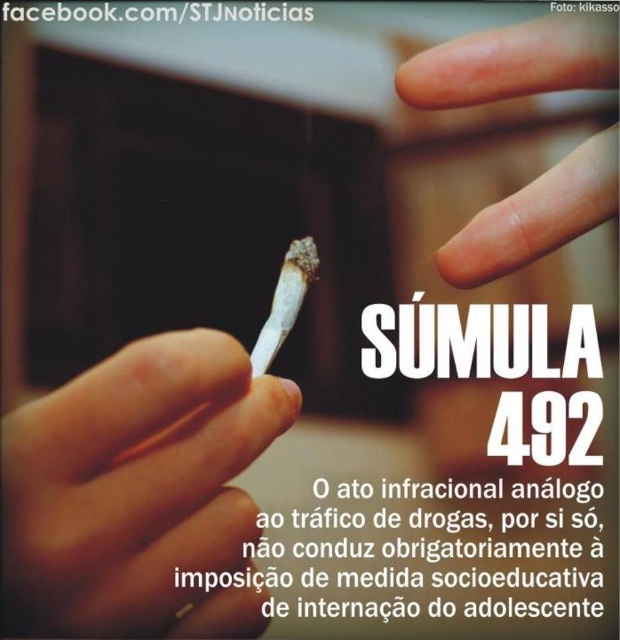
You are a legal analyst reviewing an image for a case involving drug trafficking. The image shows a white matte cigarette at center and dry skin at upper center. According to the legal text displayed in the image, which object is more likely to be associated with the act of drug trafficking?

The white matte cigarette at center is more likely to be associated with the act of drug trafficking because it is taller than the dry skin at upper center, indicating it could contain substances beyond tobacco.

What is located at the coordinates point [138,490] in the image?

The white matte cigarette at center is located at point [138,490].

You are a delivery robot with a 12 inch wide tray. You need to place a small package between the white matte cigarette at center and the dry skin at upper center without touching either. Is there enough space?

The distance between the white matte cigarette at center and the dry skin at upper center is 14.91 inches. Since your tray is 12 inches wide, there is enough space to place the package between them without touching either object.